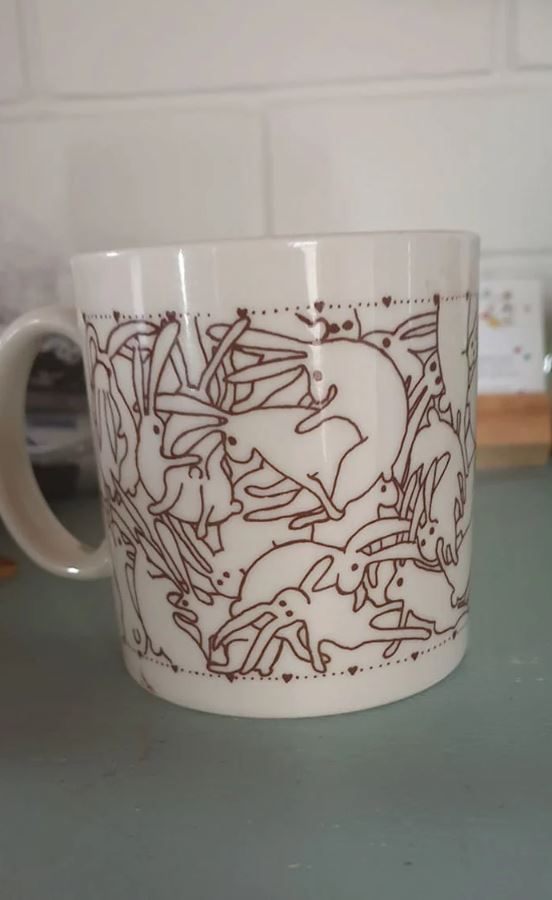
This screenshot has width=552, height=900. What are the coordinates of `mug handle` in the screenshot? It's located at (28, 508).